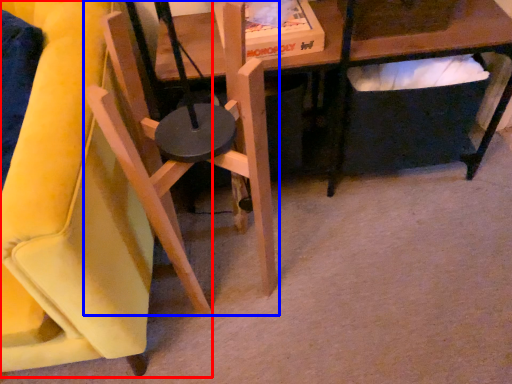
Question: Which point is further to the camera, chair (highlighted by a red box) or chair (highlighted by a blue box)?

Choices:
 (A) chair
 (B) chair

Answer: (B)